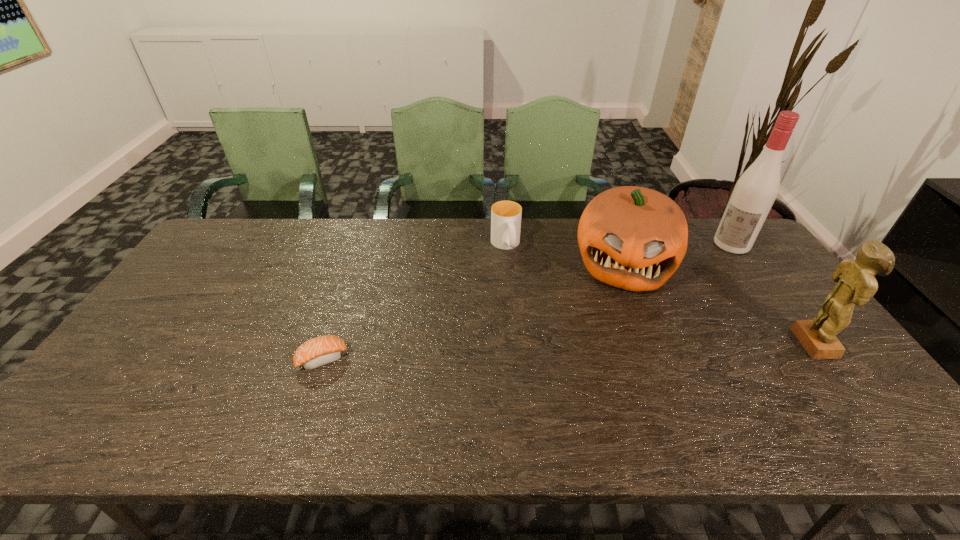
This screenshot has height=540, width=960. Identify the location of vacant space on the desktop that is between the leftmost object and the second tallest object and is positioned on the face of the pumpkin. (615, 349).

What are the coordinates of `vacant space on the desktop that is between the sushi and the figurine and is positioned on the label of the alcohol` in the screenshot? It's located at (644, 349).

You are a GUI agent. You are given a task and a screenshot of the screen. Output one action in this format:
    pyautogui.click(x=<x>, y=<y>)
    Task: Click on the free space on the desktop that is between the leftmost object and the figurine and is positioned with the handle on the side of the cup
    
    Given the screenshot: What is the action you would take?
    pyautogui.click(x=546, y=352)